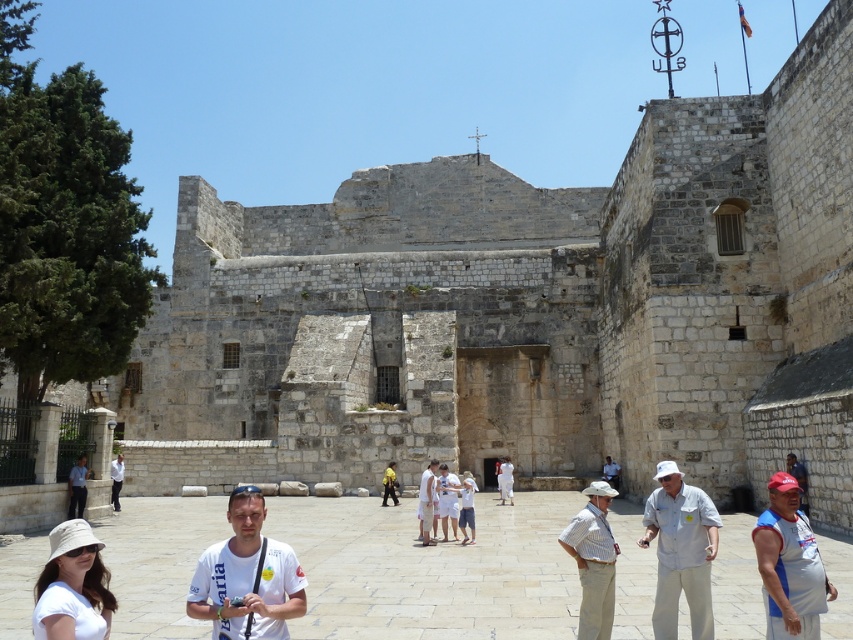
You are a photographer planning to take a group photo of the people in the courtyard. You notice the white matte hat at lower left and the yellow fabric backpack at center. Which object should you avoid placing in the center of your photo to prevent it from overshadowing other elements due to its size?

You should avoid placing the white matte hat at lower left in the center of your photo because it is bigger than the yellow fabric backpack at center, making it more likely to overshadow other elements.